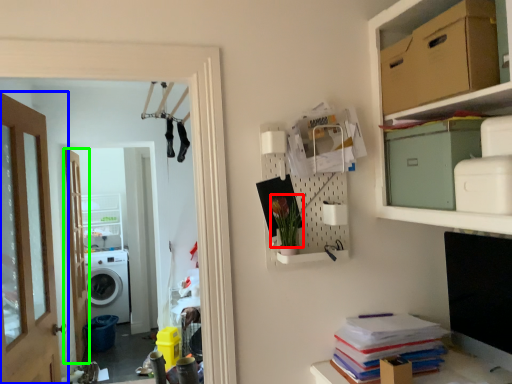
Question: Considering the real-world distances, which object is farthest from plant (highlighted by a red box)? door (highlighted by a blue box) or door (highlighted by a green box)?

Choices:
 (A) door
 (B) door

Answer: (B)